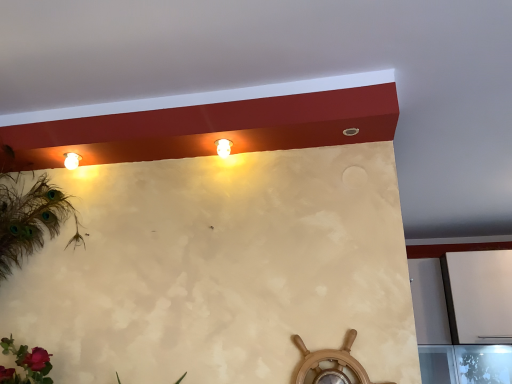
Question: Is white glossy light fixture at upper center not near matte white lamp at upper left?

Choices:
 (A) no
 (B) yes

Answer: (A)

Question: Is white glossy light fixture at upper center beside matte white lamp at upper left?

Choices:
 (A) yes
 (B) no

Answer: (B)

Question: Is white glossy light fixture at upper center wider than matte white lamp at upper left?

Choices:
 (A) yes
 (B) no

Answer: (A)

Question: From a real-world perspective, does white glossy light fixture at upper center sit lower than matte white lamp at upper left?

Choices:
 (A) no
 (B) yes

Answer: (B)

Question: Can you confirm if white glossy light fixture at upper center is taller than matte white lamp at upper left?

Choices:
 (A) yes
 (B) no

Answer: (B)

Question: Does white glossy light fixture at upper center have a smaller size compared to matte white lamp at upper left?

Choices:
 (A) yes
 (B) no

Answer: (B)

Question: Considering the relative sizes of matte white lamp at upper left and white glossy light fixture at upper center in the image provided, is matte white lamp at upper left thinner than white glossy light fixture at upper center?

Choices:
 (A) yes
 (B) no

Answer: (A)

Question: Is matte white lamp at upper left to the right of white glossy light fixture at upper center from the viewer's perspective?

Choices:
 (A) no
 (B) yes

Answer: (A)

Question: From a real-world perspective, is matte white lamp at upper left located beneath white glossy light fixture at upper center?

Choices:
 (A) yes
 (B) no

Answer: (B)

Question: Considering the relative sizes of matte white lamp at upper left and white glossy light fixture at upper center in the image provided, is matte white lamp at upper left wider than white glossy light fixture at upper center?

Choices:
 (A) no
 (B) yes

Answer: (A)

Question: Does matte white lamp at upper left appear on the left side of white glossy light fixture at upper center?

Choices:
 (A) yes
 (B) no

Answer: (A)

Question: Is matte white lamp at upper left further to the viewer compared to white glossy light fixture at upper center?

Choices:
 (A) yes
 (B) no

Answer: (A)

Question: Is white glossy light fixture at upper center bigger or smaller than matte white lamp at upper left?

Choices:
 (A) big
 (B) small

Answer: (A)